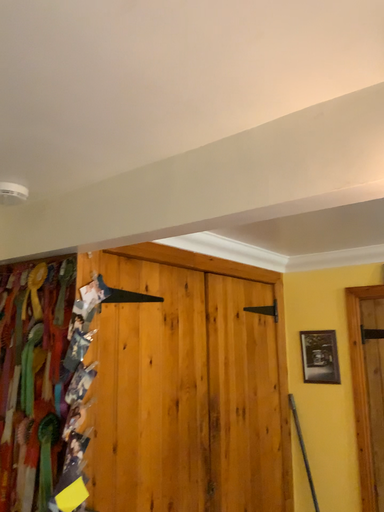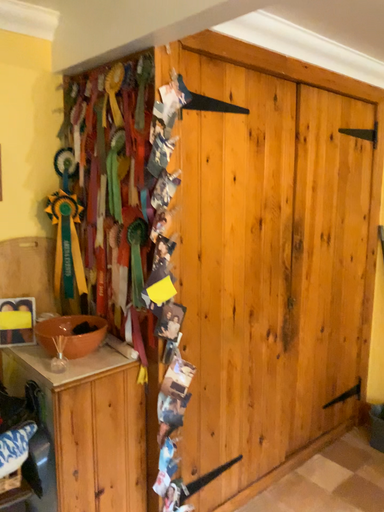
Question: Which way did the camera rotate in the video?

Choices:
 (A) rotated right
 (B) rotated left

Answer: (B)